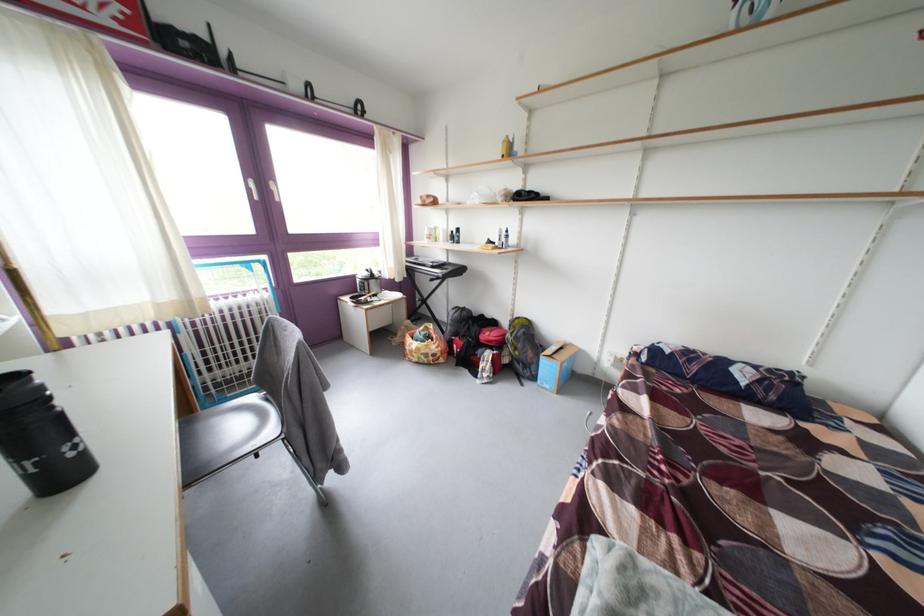
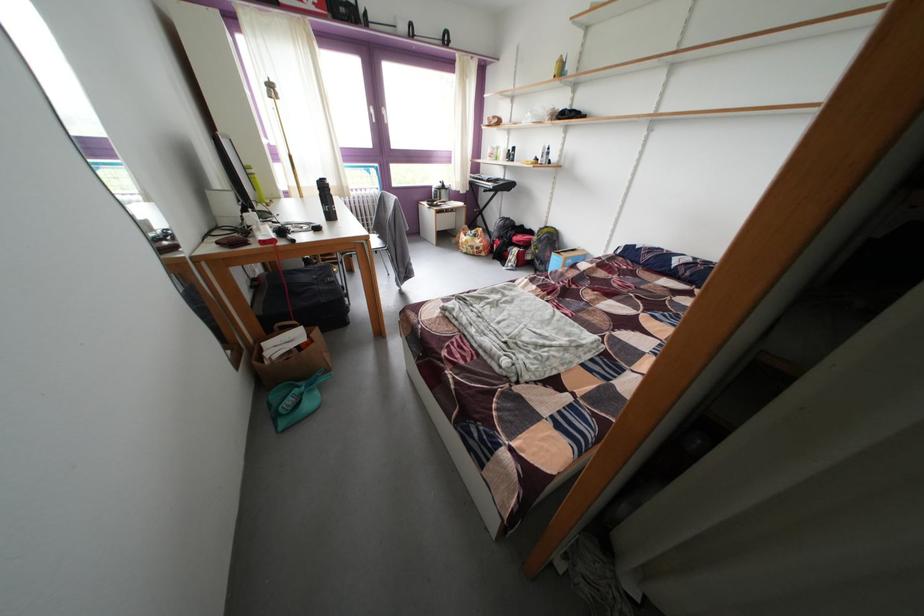
Find the pixel in the second image that matches point (529, 371) in the first image.

(548, 269)